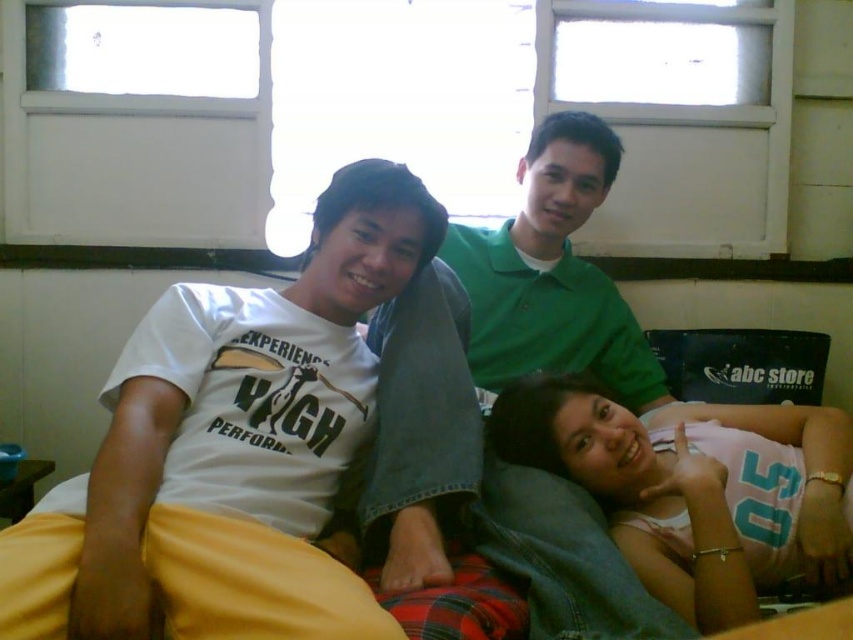
Question: From the image, what is the correct spatial relationship of white matte t-shirt at center in relation to pink fabric at center?

Choices:
 (A) left
 (B) right

Answer: (A)

Question: Does white matte t-shirt at center appear over pink fabric at center?

Choices:
 (A) no
 (B) yes

Answer: (B)

Question: Considering the relative positions of white matte t-shirt at center and pink fabric at center in the image provided, where is white matte t-shirt at center located with respect to pink fabric at center?

Choices:
 (A) left
 (B) right

Answer: (A)

Question: Which point appears farthest from the camera in this image?

Choices:
 (A) (718, 611)
 (B) (20, 637)

Answer: (A)